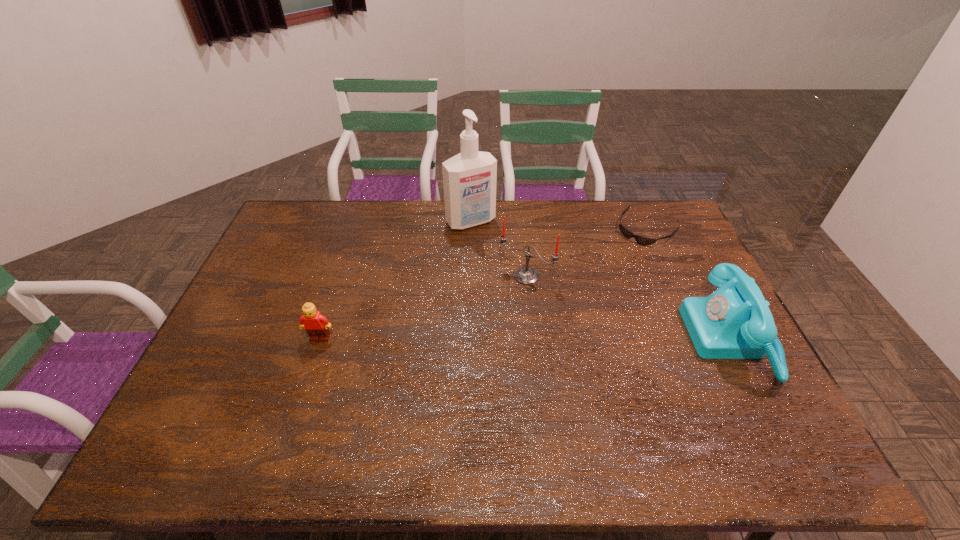
This screenshot has height=540, width=960. Identify the location of the leftmost object. (316, 325).

At what (x,y) coordinates should I click in order to perform the action: click on Lego. Please return your answer as a coordinate pair (x, y). Looking at the image, I should click on (316, 325).

This screenshot has width=960, height=540. What are the coordinates of `telephone` in the screenshot? It's located at (734, 322).

This screenshot has height=540, width=960. What are the coordinates of `candle` in the screenshot? It's located at (526, 275).

The height and width of the screenshot is (540, 960). In order to click on the third object from right to left in this screenshot , I will do `click(526, 275)`.

Where is `the second object from left to right`? The width and height of the screenshot is (960, 540). the second object from left to right is located at coordinates (469, 178).

Identify the location of the tallest object. (469, 178).

At what (x,y) coordinates should I click in order to perform the action: click on the shortest object. Please return your answer as a coordinate pair (x, y). This screenshot has width=960, height=540. Looking at the image, I should click on (641, 240).

Locate an element on the screen. The image size is (960, 540). vacant position located 0.120m on the face of the second shortest object is located at coordinates click(x=306, y=380).

This screenshot has height=540, width=960. Find the location of `vacant area located 0.240m on the dial of the telephone`. vacant area located 0.240m on the dial of the telephone is located at coordinates (605, 339).